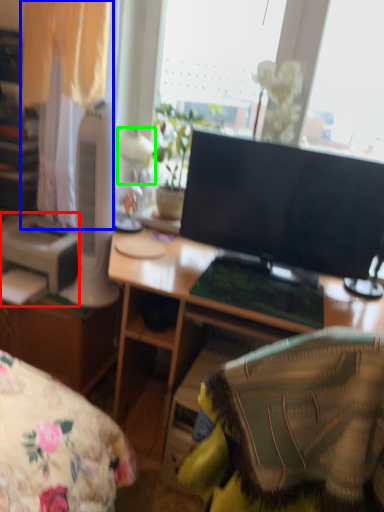
Question: Which object is positioned farthest from printer (highlighted by a red box)? Select from curtain (highlighted by a blue box) and table lamp (highlighted by a green box).

Choices:
 (A) curtain
 (B) table lamp

Answer: (B)